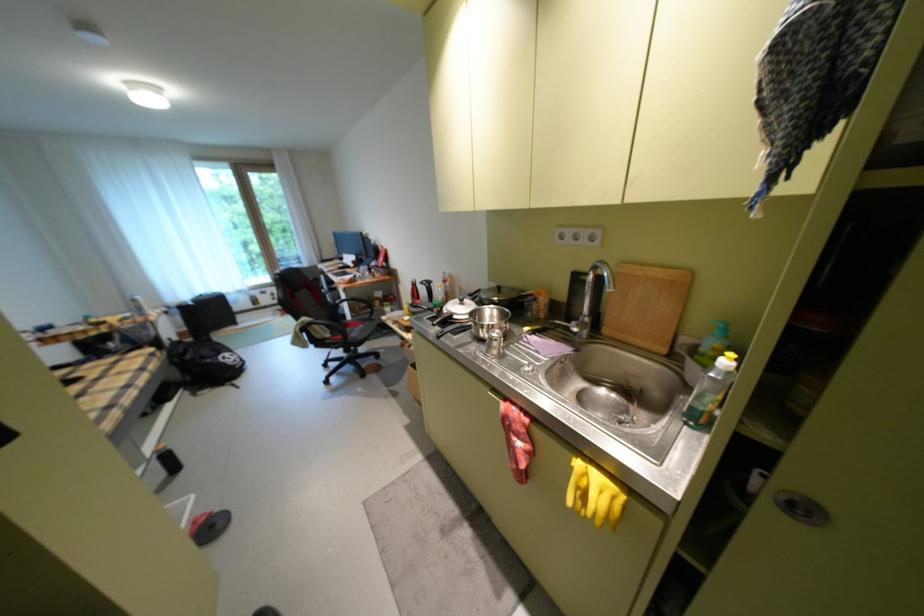
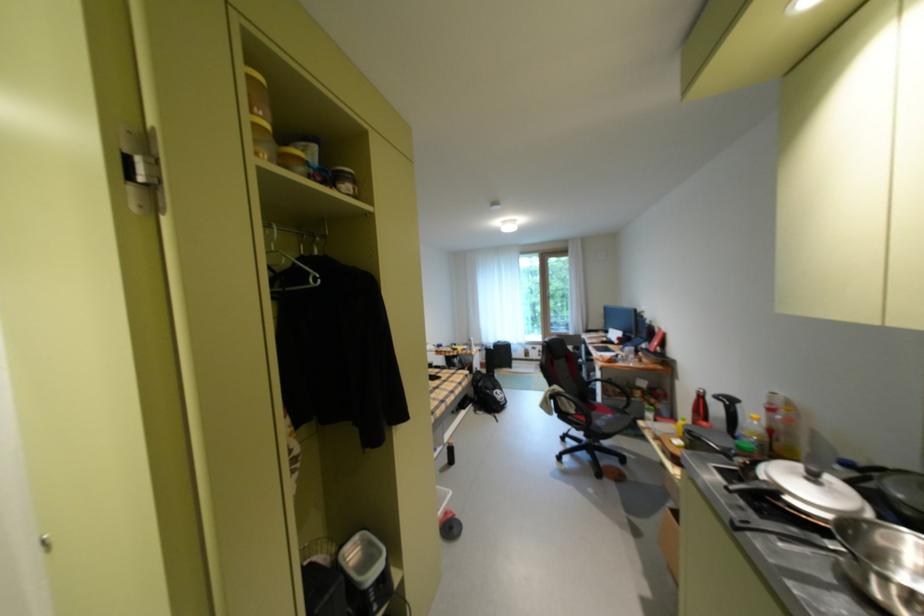
Find the pixel in the second image that matches point 378,323 in the first image.

(629, 416)